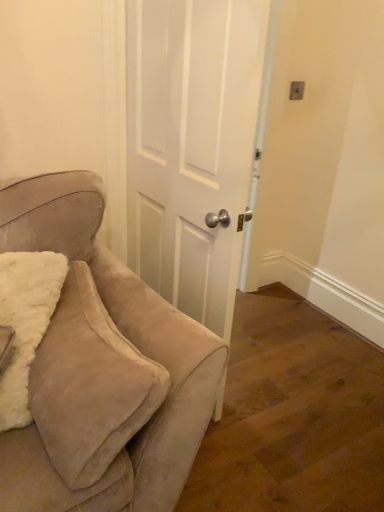
The image size is (384, 512). Describe the element at coordinates (191, 145) in the screenshot. I see `white matte door at center` at that location.

The width and height of the screenshot is (384, 512). What are the coordinates of `white matte door at center` in the screenshot? It's located at (191, 145).

What is the approximate width of white matte door at center?

The width of white matte door at center is 7.18 inches.

Image resolution: width=384 pixels, height=512 pixels. What do you see at coordinates (96, 359) in the screenshot? I see `suede beige chair at left` at bounding box center [96, 359].

You are a GUI agent. You are given a task and a screenshot of the screen. Output one action in this format:
    pyautogui.click(x=<x>, y=<y>)
    Task: Click on the suede beige chair at left
    The image size is (384, 512).
    Given the screenshot: What is the action you would take?
    pyautogui.click(x=96, y=359)

The width and height of the screenshot is (384, 512). I want to click on white matte door at center, so click(191, 145).

Considering the positions of objects suede beige chair at left and white matte door at center in the image provided, who is more to the left, suede beige chair at left or white matte door at center?

suede beige chair at left is more to the left.

Is suede beige chair at left positioned in front of white matte door at center?

Yes, the depth of suede beige chair at left is less than that of white matte door at center.

Which point is more distant from viewer, (x=131, y=282) or (x=213, y=149)?

The point (x=213, y=149) is more distant.

From the image's perspective, between suede beige chair at left and white matte door at center, who is located below?

From the image's view, suede beige chair at left is below.

From a real-world perspective, between suede beige chair at left and white matte door at center, who is vertically higher?

white matte door at center is physically above.

Can you confirm if suede beige chair at left is thinner than white matte door at center?

Incorrect, the width of suede beige chair at left is not less than that of white matte door at center.

Who is taller, suede beige chair at left or white matte door at center?

Standing taller between the two is white matte door at center.

Based on the photo, does suede beige chair at left have a larger size compared to white matte door at center?

Actually, suede beige chair at left might be smaller than white matte door at center.

Does suede beige chair at left contain white matte door at center?

No, white matte door at center is not surrounded by suede beige chair at left.

Is suede beige chair at left with white matte door at center?

A: No.

Is suede beige chair at left aimed at white matte door at center?

No, suede beige chair at left does not turn towards white matte door at center.

What are the coordinates of `door behind the suede beige chair at left` in the screenshot? It's located at (191, 145).

Which object is positioned more to the left, white matte door at center or suede beige chair at left?

From the viewer's perspective, suede beige chair at left appears more on the left side.

Which object is closer to the camera, white matte door at center or suede beige chair at left?

suede beige chair at left is closer to the camera.

Is point (201, 130) closer to camera compared to point (41, 236)?

No.

From the image's perspective, between white matte door at center and suede beige chair at left, which one is located above?

white matte door at center is shown above in the image.

From a real-world perspective, between white matte door at center and suede beige chair at left, who is vertically higher?

white matte door at center.

Can you confirm if white matte door at center is thinner than suede beige chair at left?

Correct, the width of white matte door at center is less than that of suede beige chair at left.

Does white matte door at center have a lesser height compared to suede beige chair at left?

No.

Is white matte door at center bigger or smaller than suede beige chair at left?

white matte door at center is bigger than suede beige chair at left.

Which is correct: white matte door at center is inside suede beige chair at left, or outside of it?

white matte door at center lies outside suede beige chair at left.

Is there a large distance between white matte door at center and suede beige chair at left?

That's not correct — white matte door at center is a little close to suede beige chair at left.

Is suede beige chair at left at the back of white matte door at center?

Yes, white matte door at center is positioned with its back facing suede beige chair at left.

Can you tell me how much white matte door at center and suede beige chair at left differ in facing direction?

The facing directions of white matte door at center and suede beige chair at left are 176 degrees apart.

You are a GUI agent. You are given a task and a screenshot of the screen. Output one action in this format:
    pyautogui.click(x=<x>, y=<y>)
    Task: Click on the chair on the left of white matte door at center
    Image resolution: width=384 pixels, height=512 pixels.
    Given the screenshot: What is the action you would take?
    pyautogui.click(x=96, y=359)

You are a GUI agent. You are given a task and a screenshot of the screen. Output one action in this format:
    pyautogui.click(x=<x>, y=<y>)
    Task: Click on the chair below the white matte door at center (from the image's perspective)
    
    Given the screenshot: What is the action you would take?
    pyautogui.click(x=96, y=359)

The width and height of the screenshot is (384, 512). I want to click on door above the suede beige chair at left (from the image's perspective), so click(x=191, y=145).